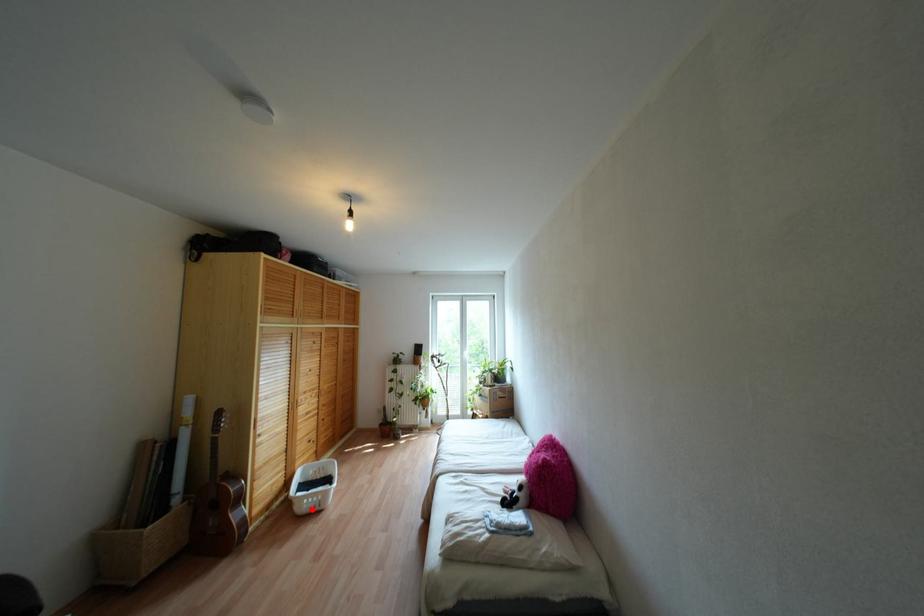
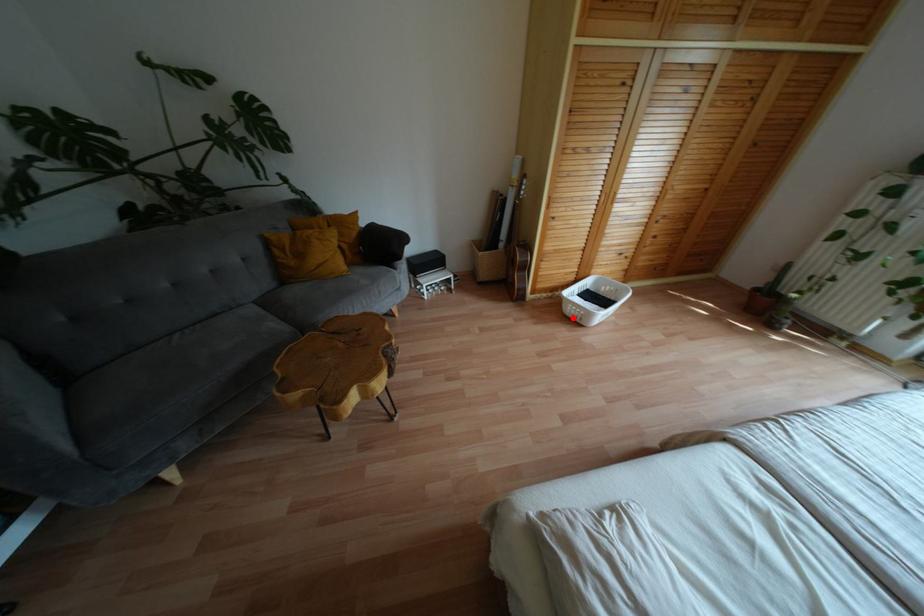
I am providing you with two images of the same scene from different viewpoints. A red point is marked on the first image and another point is marked on the second image. Do the highlighted points in image1 and image2 indicate the same real-world spot?

Yes